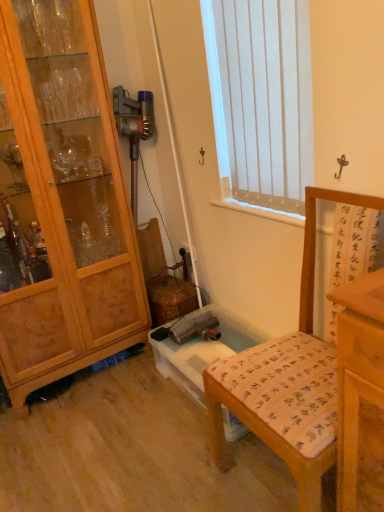
Question: Is wooden chair with printed cushion at lower right facing away from wooden cabinet at left?

Choices:
 (A) no
 (B) yes

Answer: (A)

Question: From the image's perspective, is wooden chair with printed cushion at lower right located beneath wooden cabinet at left?

Choices:
 (A) yes
 (B) no

Answer: (A)

Question: From a real-world perspective, is wooden chair with printed cushion at lower right positioned under wooden cabinet at left based on gravity?

Choices:
 (A) no
 (B) yes

Answer: (B)

Question: Is wooden chair with printed cushion at lower right outside of wooden cabinet at left?

Choices:
 (A) no
 (B) yes

Answer: (B)

Question: Is wooden cabinet at left completely or partially inside wooden chair with printed cushion at lower right?

Choices:
 (A) yes
 (B) no

Answer: (B)

Question: Visually, is white vertical blinds at upper center positioned to the left or to the right of wooden cabinet at left?

Choices:
 (A) right
 (B) left

Answer: (A)

Question: From the image's perspective, relative to wooden cabinet at left, is white vertical blinds at upper center above or below?

Choices:
 (A) below
 (B) above

Answer: (B)

Question: Is white vertical blinds at upper center taller or shorter than wooden cabinet at left?

Choices:
 (A) short
 (B) tall

Answer: (A)

Question: Do you think white vertical blinds at upper center is within wooden cabinet at left, or outside of it?

Choices:
 (A) inside
 (B) outside

Answer: (B)

Question: Visually, is white vertical blinds at upper center positioned to the left or to the right of wooden chair with printed cushion at lower right?

Choices:
 (A) right
 (B) left

Answer: (B)

Question: From the image's perspective, is white vertical blinds at upper center positioned above or below wooden chair with printed cushion at lower right?

Choices:
 (A) above
 (B) below

Answer: (A)

Question: Is white vertical blinds at upper center in front of or behind wooden chair with printed cushion at lower right in the image?

Choices:
 (A) front
 (B) behind

Answer: (B)

Question: Looking at the image, does white vertical blinds at upper center seem bigger or smaller compared to wooden chair with printed cushion at lower right?

Choices:
 (A) small
 (B) big

Answer: (A)

Question: Considering their positions, is wooden chair with printed cushion at lower right located in front of or behind wooden cabinet at left?

Choices:
 (A) behind
 (B) front

Answer: (B)

Question: From the image's perspective, is wooden chair with printed cushion at lower right above or below wooden cabinet at left?

Choices:
 (A) above
 (B) below

Answer: (B)